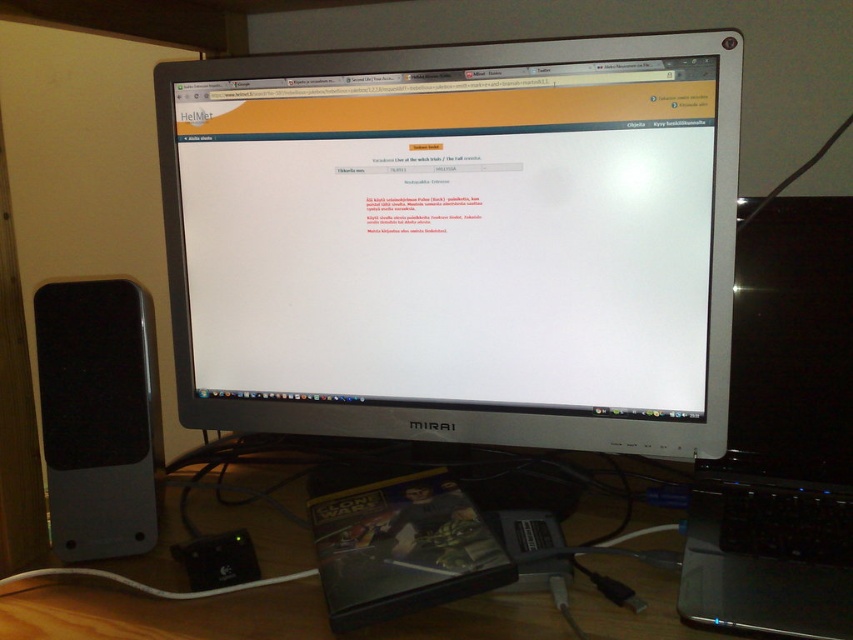
Locate an element on the screen. This screenshot has height=640, width=853. black glossy laptop at right is located at coordinates (781, 436).

Is point (845, 586) positioned before point (785, 611)?

That is False.

Between point (718, 468) and point (759, 616), which one is positioned behind?

The point (718, 468) is more distant.

I want to click on black glossy laptop at right, so click(x=781, y=436).

Is silver metallic monitor at center to the left of black glossy laptop at right from the viewer's perspective?

Correct, you'll find silver metallic monitor at center to the left of black glossy laptop at right.

Can you confirm if silver metallic monitor at center is positioned above black glossy laptop at right?

Yes, silver metallic monitor at center is above black glossy laptop at right.

Which is behind, point (334, 214) or point (815, 326)?

The point (334, 214) is more distant.

Find the location of a particular element. The image size is (853, 640). silver metallic monitor at center is located at coordinates (457, 241).

Does wooden at lower left have a greater width compared to black matte speaker at left?

Correct, the width of wooden at lower left exceeds that of black matte speaker at left.

Where is `wooden at lower left`? wooden at lower left is located at coordinates (762, 556).